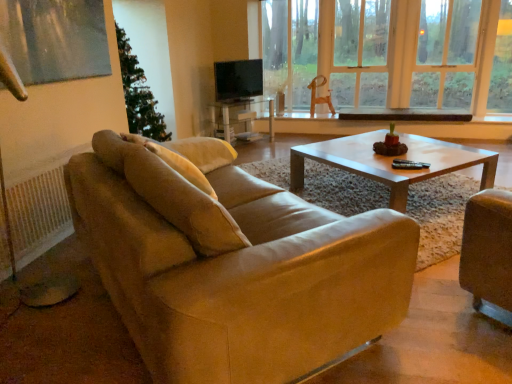
Question: From their relative heights in the image, would you say black plastic corded phone at center is taller or shorter than beige fabric pillow at upper left?

Choices:
 (A) short
 (B) tall

Answer: (A)

Question: From a real-world perspective, is black plastic corded phone at center above or below beige fabric pillow at upper left?

Choices:
 (A) below
 (B) above

Answer: (A)

Question: Estimate the real-world distances between objects in this image. Which object is farther from the matte black tv at center?

Choices:
 (A) black plastic corded phone at center
 (B) wooden swivel chair at center
 (C) beige fabric pillow at upper left
 (D) matte glass coffee table at center
 (E) suede beige couch at center

Answer: (E)

Question: Estimate the real-world distances between objects in this image. Which object is farther from the suede beige couch at center?

Choices:
 (A) wooden swivel chair at center
 (B) beige fabric pillow at upper left
 (C) matte black tv at center
 (D) matte glass coffee table at center
 (E) black plastic corded phone at center

Answer: (A)